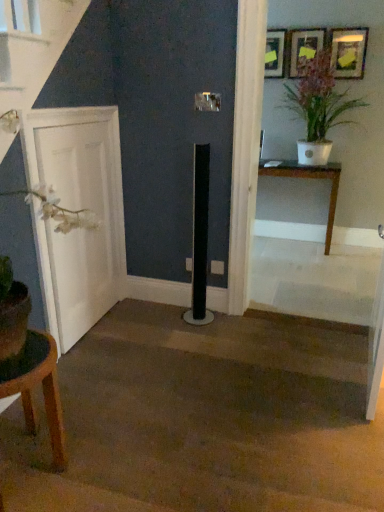
Image resolution: width=384 pixels, height=512 pixels. I want to click on free space to the right of white matte door at left, so click(159, 338).